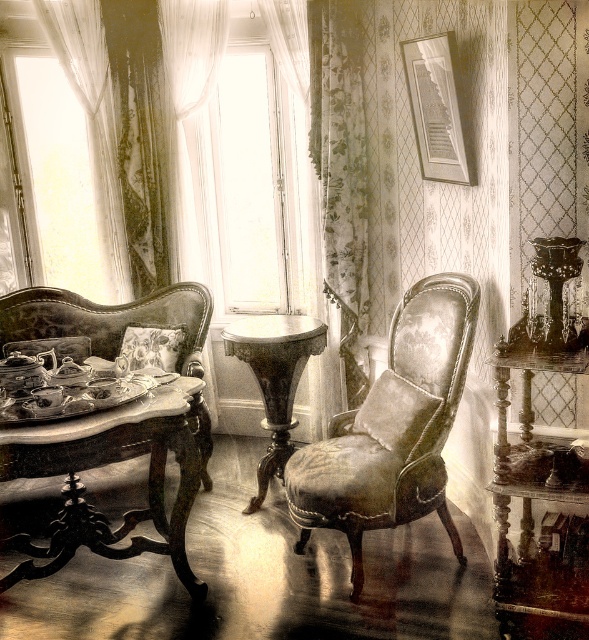
You are arranging a small floral arrangement and need to place it on the wooden polished table at center or the transparent glass window at center. Which surface can accommodate a wider object?

The wooden polished table at center can accommodate a wider object since it is wider than the transparent glass window at center.

You are an interior designer assessing the room layout. The transparent glass window at center and the floral fabric curtain at upper right are both visible from the entrance. Which object is wider when viewed from the entrance?

The transparent glass window at center is wider than the floral fabric curtain at upper right.

You are arranging flowers in this vintage room. You have a vase to place on the wooden polished table at center and want to ensure it doesn not block the view of the floral fabric curtain at upper right. Based on their positions, can you place the vase on the table without obstructing the curtain?

The wooden polished table at center is to the left of the floral fabric curtain at upper right, so placing the vase on the table would not block the view of the curtain since the table is positioned to the left of it.